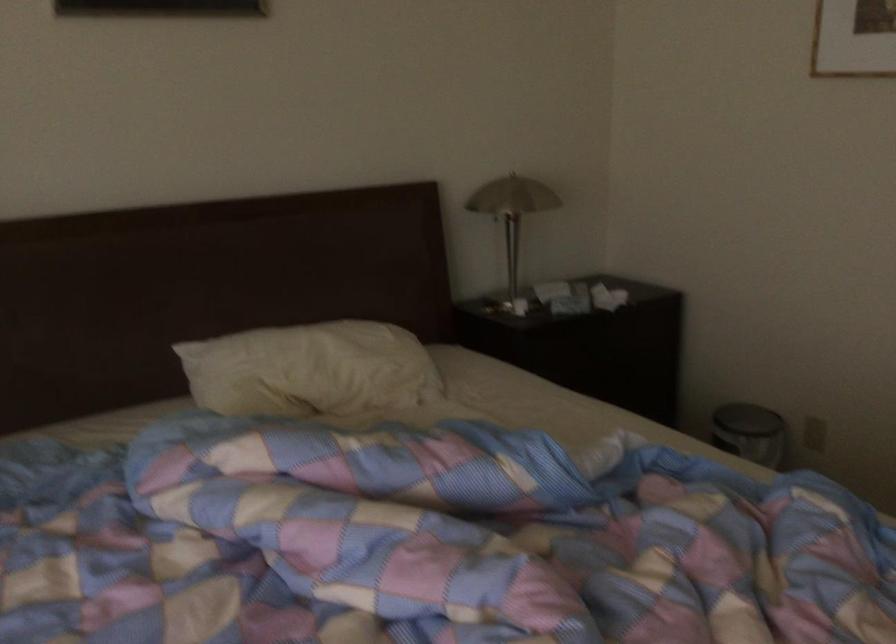
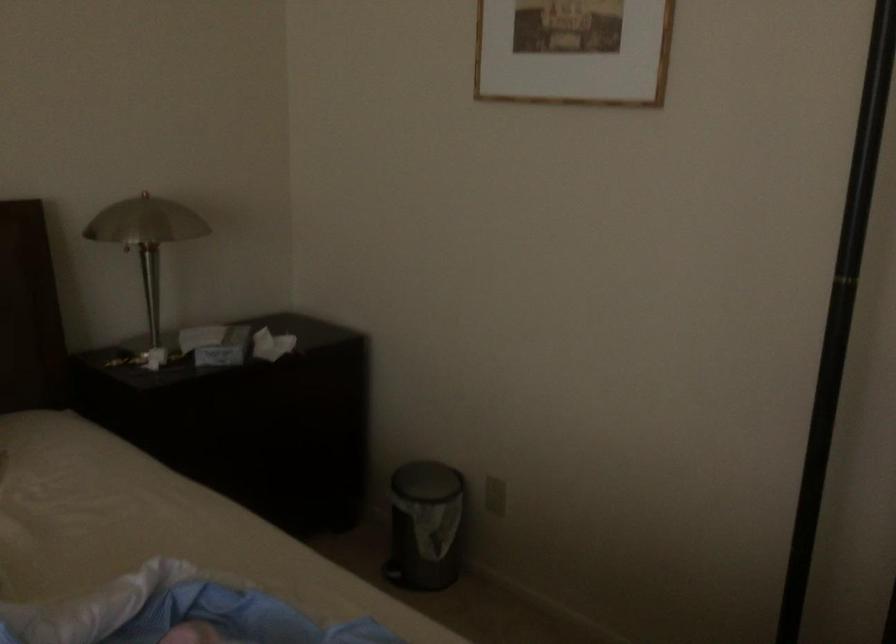
Where in the second image is the point corresponding to the point at 606,296 from the first image?

(271, 345)